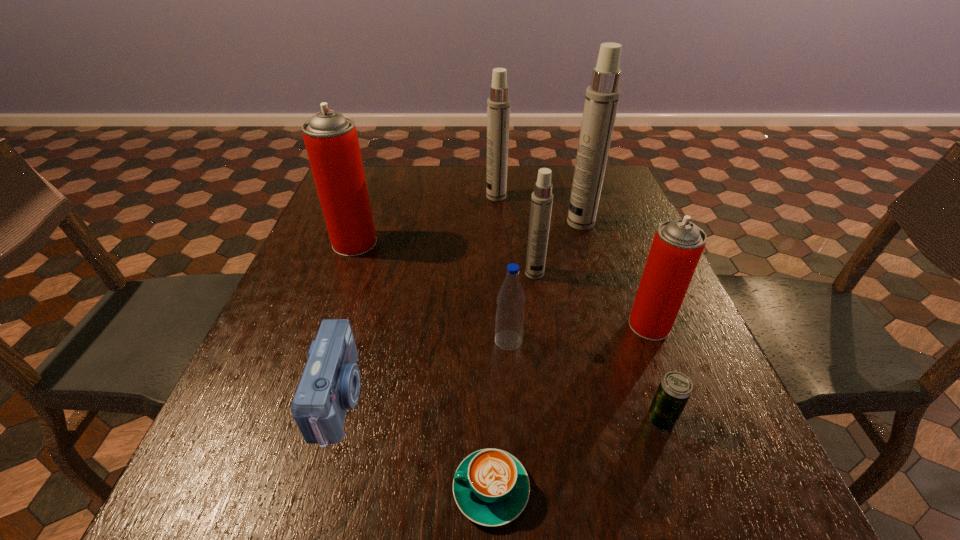
Where is `the rightmost white aerosol can`? This screenshot has width=960, height=540. the rightmost white aerosol can is located at coordinates (602, 97).

What are the coordinates of `the biggest white aerosol can` in the screenshot? It's located at (602, 97).

Where is `the leftmost aerosol can`? The height and width of the screenshot is (540, 960). the leftmost aerosol can is located at coordinates (331, 140).

Locate an element on the screen. This screenshot has width=960, height=540. the left red aerosol can is located at coordinates (331, 140).

In order to click on the farthest object in this screenshot , I will do `click(498, 104)`.

At what (x,y) coordinates should I click in order to perform the action: click on the leftmost white aerosol can. Please return your answer as a coordinate pair (x, y). The height and width of the screenshot is (540, 960). Looking at the image, I should click on (498, 104).

At what (x,y) coordinates should I click in order to perform the action: click on the nearer red aerosol can. Please return your answer as a coordinate pair (x, y). Image resolution: width=960 pixels, height=540 pixels. Looking at the image, I should click on (677, 246).

Locate an element on the screen. the right red aerosol can is located at coordinates pyautogui.click(x=677, y=246).

Find the location of a particular element. The height and width of the screenshot is (540, 960). the second nearest aerosol can is located at coordinates (542, 198).

Where is `the second white aerosol can from right to left`? The image size is (960, 540). the second white aerosol can from right to left is located at coordinates (542, 198).